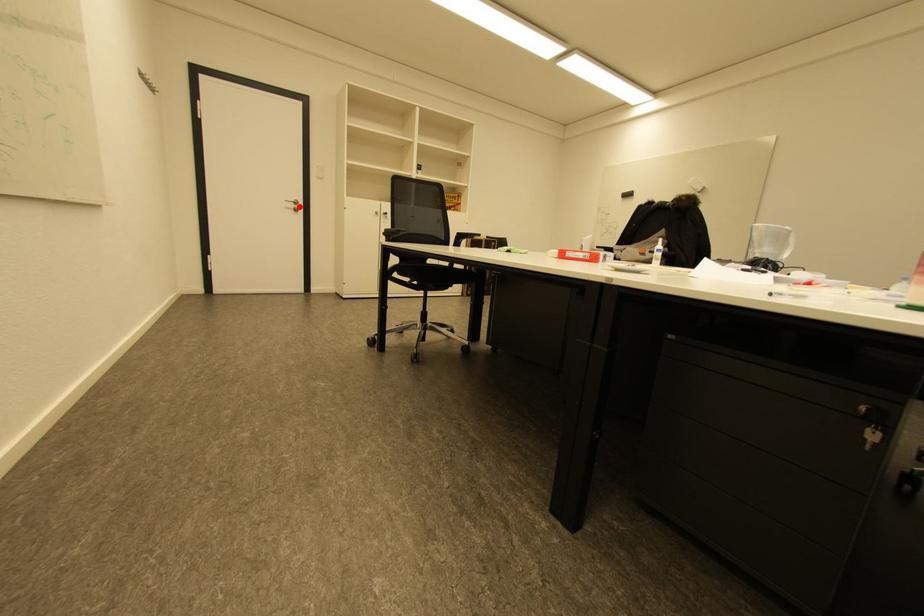
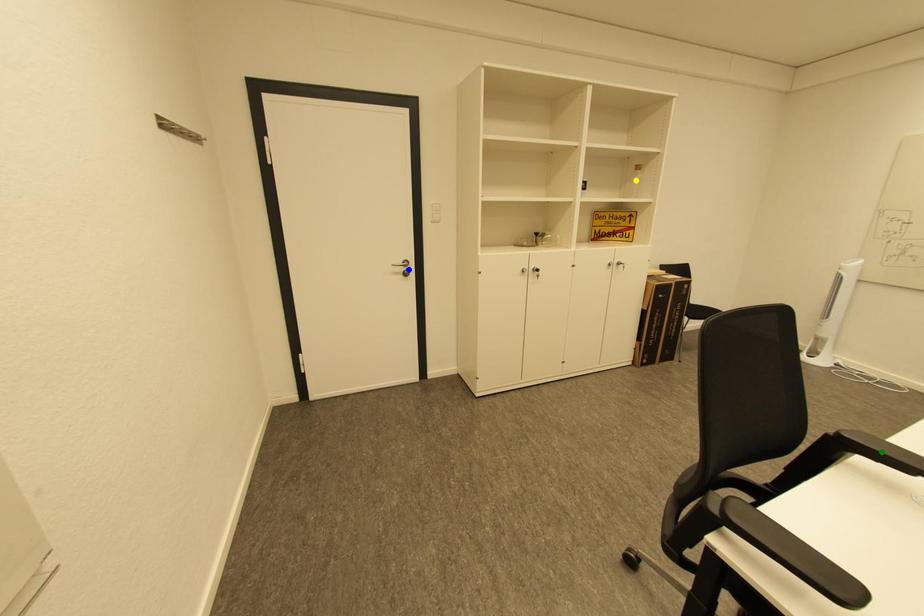
Question: I am providing you with two images of the same scene from different viewpoints. A red point is marked on the first image. You are given multiple points on the second image. Which point in image 2 is actually the same real-world point as the red point in image 1?

Choices:
 (A) blue point
 (B) yellow point
 (C) green point

Answer: (A)